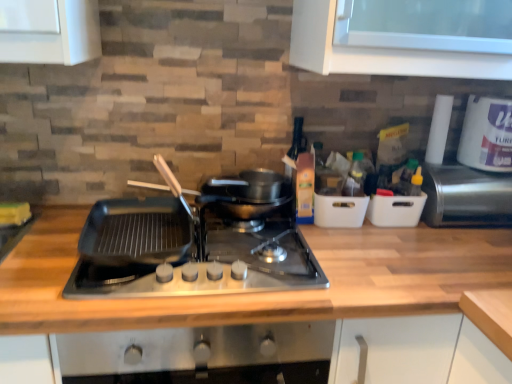
Question: Can you confirm if white plastic container at right, the 1th appliance when ordered from left to right, is thinner than white plastic container at upper right?

Choices:
 (A) yes
 (B) no

Answer: (A)

Question: Is white plastic container at right, marked as the 2th appliance in a right-to-left arrangement, not inside white plastic container at upper right?

Choices:
 (A) no
 (B) yes

Answer: (B)

Question: Does white plastic container at right, marked as the 2th appliance in a right-to-left arrangement, lie behind white plastic container at upper right?

Choices:
 (A) no
 (B) yes

Answer: (B)

Question: Considering the relative positions of white plastic container at right, the 1th appliance when ordered from left to right, and white plastic container at upper right in the image provided, is white plastic container at right, the 1th appliance when ordered from left to right, to the right of white plastic container at upper right from the viewer's perspective?

Choices:
 (A) no
 (B) yes

Answer: (A)

Question: From a real-world perspective, is white plastic container at right, the 1th appliance when ordered from left to right, under white plastic container at upper right?

Choices:
 (A) yes
 (B) no

Answer: (A)

Question: Considering the positions of point (407, 205) and point (338, 253), is point (407, 205) closer or farther from the camera than point (338, 253)?

Choices:
 (A) farther
 (B) closer

Answer: (A)

Question: From a real-world perspective, is white plastic container at right, marked as the 2th appliance in a right-to-left arrangement, physically located above or below wooden at center?

Choices:
 (A) below
 (B) above

Answer: (B)

Question: Is white plastic container at right, the 1th appliance when ordered from left to right, in front of or behind wooden at center in the image?

Choices:
 (A) behind
 (B) front

Answer: (A)

Question: In the image, is white plastic container at right, marked as the 2th appliance in a right-to-left arrangement, on the left side or the right side of wooden at center?

Choices:
 (A) left
 (B) right

Answer: (B)

Question: Is point (x=115, y=228) positioned closer to the camera than point (x=464, y=182)?

Choices:
 (A) farther
 (B) closer

Answer: (B)

Question: Is black matte griddle at center wider or thinner than metallic stainless steel toaster at right, the 1th appliance positioned from the right?

Choices:
 (A) wide
 (B) thin

Answer: (A)

Question: Is black matte griddle at center in front of or behind metallic stainless steel toaster at right, the 1th appliance positioned from the right, in the image?

Choices:
 (A) front
 (B) behind

Answer: (A)

Question: Which is correct: black matte griddle at center is inside metallic stainless steel toaster at right, which is counted as the 2th appliance, starting from the left, or outside of it?

Choices:
 (A) outside
 (B) inside

Answer: (A)

Question: From the image's perspective, relative to black matte griddle at center, is white plastic container at right, marked as the 2th appliance in a right-to-left arrangement, above or below?

Choices:
 (A) above
 (B) below

Answer: (A)

Question: Considering the positions of point (404, 225) and point (218, 258), is point (404, 225) closer or farther from the camera than point (218, 258)?

Choices:
 (A) farther
 (B) closer

Answer: (A)